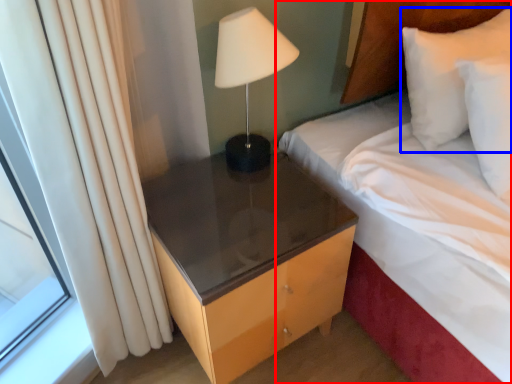
Question: Which object appears farthest to the camera in this image, bed (highlighted by a red box) or pillow (highlighted by a blue box)?

Choices:
 (A) bed
 (B) pillow

Answer: (B)